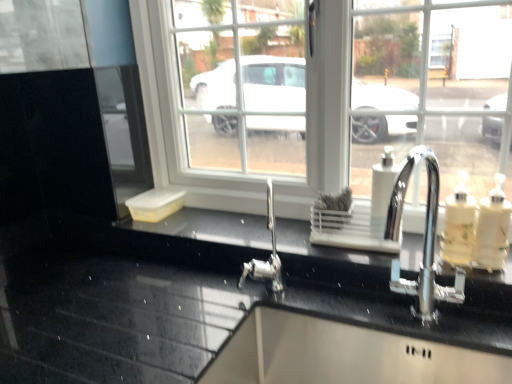
Question: From the image's perspective, is translucent plastic soap dispenser at right, positioned as the 2th soap dispenser in right-to-left order, below white plastic soap dispenser at center-right, marked as the third soap dispenser in a right-to-left arrangement?

Choices:
 (A) yes
 (B) no

Answer: (A)

Question: Is the depth of translucent plastic soap dispenser at right, positioned as the 2th soap dispenser in left-to-right order, greater than that of white plastic soap dispenser at center-right, arranged as the 1th soap dispenser when viewed from the left?

Choices:
 (A) no
 (B) yes

Answer: (A)

Question: Is translucent plastic soap dispenser at right, positioned as the 2th soap dispenser in right-to-left order, beside white plastic soap dispenser at center-right, marked as the third soap dispenser in a right-to-left arrangement?

Choices:
 (A) yes
 (B) no

Answer: (B)

Question: Is translucent plastic soap dispenser at right, positioned as the 2th soap dispenser in right-to-left order, at the right side of white plastic soap dispenser at center-right, marked as the third soap dispenser in a right-to-left arrangement?

Choices:
 (A) yes
 (B) no

Answer: (A)

Question: Is translucent plastic soap dispenser at right, positioned as the 2th soap dispenser in left-to-right order, facing away from white plastic soap dispenser at center-right, marked as the third soap dispenser in a right-to-left arrangement?

Choices:
 (A) yes
 (B) no

Answer: (B)

Question: From a real-world perspective, is black glossy countertop at center physically located above or below white glossy soap dispenser at right, positioned as the 3th soap dispenser in left-to-right order?

Choices:
 (A) below
 (B) above

Answer: (A)

Question: In the image, is black glossy countertop at center positioned in front of or behind white glossy soap dispenser at right, acting as the 1th soap dispenser starting from the right?

Choices:
 (A) behind
 (B) front

Answer: (A)

Question: Is black glossy countertop at center inside or outside of white glossy soap dispenser at right, positioned as the 3th soap dispenser in left-to-right order?

Choices:
 (A) inside
 (B) outside

Answer: (B)

Question: Is point (292, 241) positioned closer to the camera than point (480, 221)?

Choices:
 (A) farther
 (B) closer

Answer: (A)

Question: Considering the positions of white glossy soap dispenser at right, positioned as the 3th soap dispenser in left-to-right order, and white plastic soap dispenser at center-right, arranged as the 1th soap dispenser when viewed from the left, in the image, is white glossy soap dispenser at right, positioned as the 3th soap dispenser in left-to-right order, wider or thinner than white plastic soap dispenser at center-right, arranged as the 1th soap dispenser when viewed from the left,?

Choices:
 (A) wide
 (B) thin

Answer: (A)

Question: Would you say white glossy soap dispenser at right, acting as the 1th soap dispenser starting from the right, is to the left or to the right of white plastic soap dispenser at center-right, arranged as the 1th soap dispenser when viewed from the left, in the picture?

Choices:
 (A) left
 (B) right

Answer: (B)

Question: In the image, is white glossy soap dispenser at right, positioned as the 3th soap dispenser in left-to-right order, positioned in front of or behind white plastic soap dispenser at center-right, marked as the third soap dispenser in a right-to-left arrangement?

Choices:
 (A) behind
 (B) front

Answer: (B)

Question: Is white glossy soap dispenser at right, acting as the 1th soap dispenser starting from the right, bigger or smaller than white plastic soap dispenser at center-right, arranged as the 1th soap dispenser when viewed from the left?

Choices:
 (A) small
 (B) big

Answer: (B)

Question: In the image, is white glossy soap dispenser at right, acting as the 1th soap dispenser starting from the right, positioned in front of or behind translucent plastic soap dispenser at right, positioned as the 2th soap dispenser in right-to-left order?

Choices:
 (A) front
 (B) behind

Answer: (A)

Question: Is point (486, 256) positioned closer to the camera than point (464, 251)?

Choices:
 (A) closer
 (B) farther

Answer: (A)